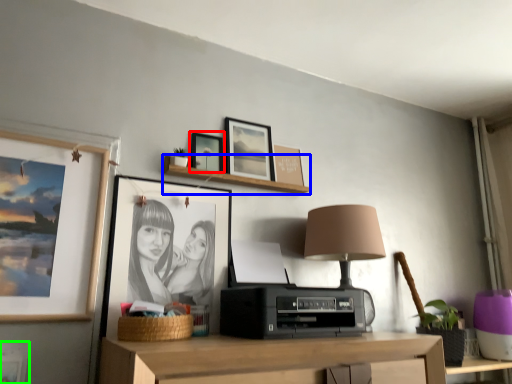
Question: Estimate the real-world distances between objects in this image. Which object is farther from picture frame (highlighted by a red box), shelf (highlighted by a blue box) or picture frame (highlighted by a green box)?

Choices:
 (A) shelf
 (B) picture frame

Answer: (B)